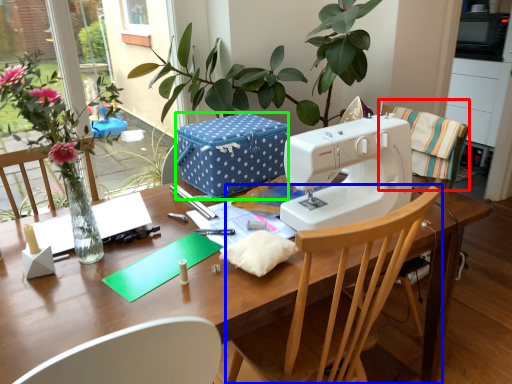
Question: Estimate the real-world distances between objects in this image. Which object is farther from chair (highlighted by a red box), chair (highlighted by a blue box) or cardboard box (highlighted by a green box)?

Choices:
 (A) chair
 (B) cardboard box

Answer: (A)